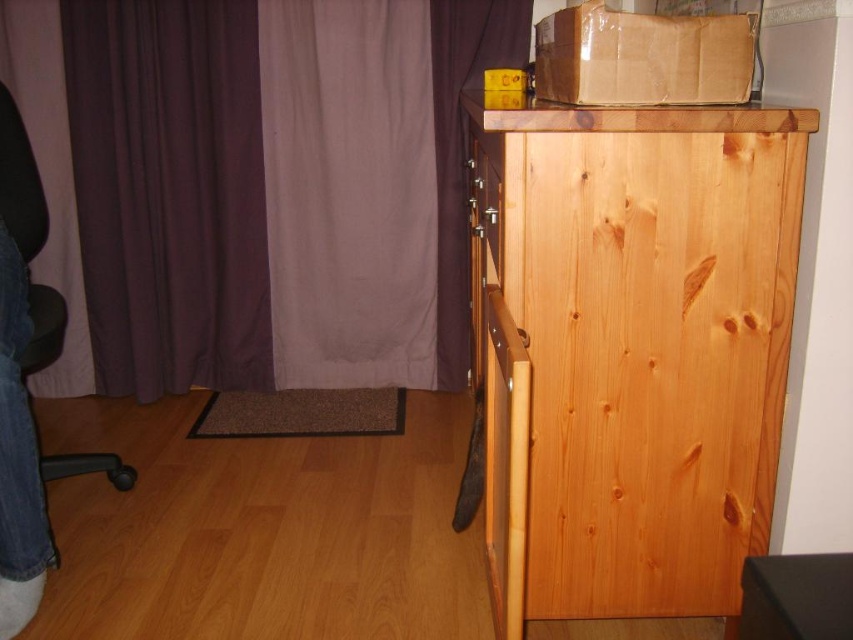
Does point (196, 228) come in front of point (7, 381)?

No, (196, 228) is further to viewer.

Based on the photo, is purple fabric curtain at upper left above denim jeans at lower left?

Yes.

What do you see at coordinates (170, 193) in the screenshot? I see `purple fabric curtain at upper left` at bounding box center [170, 193].

Where is `purple fabric curtain at upper left`? purple fabric curtain at upper left is located at coordinates (170, 193).

Is the position of natural wood dresser at upper right less distant than that of denim jeans at lower left?

That is True.

Is point (575, 209) closer to camera compared to point (41, 568)?

Yes, point (575, 209) is in front of point (41, 568).

Image resolution: width=853 pixels, height=640 pixels. I want to click on natural wood dresser at upper right, so click(631, 348).

You are a GUI agent. You are given a task and a screenshot of the screen. Output one action in this format:
    pyautogui.click(x=<x>, y=<y>)
    Task: Click on the natural wood dresser at upper right
    This screenshot has height=640, width=853.
    Given the screenshot: What is the action you would take?
    pyautogui.click(x=631, y=348)

Who is shorter, denim jeans at lower left or black mesh chair at left?

black mesh chair at left

Is point (0, 252) less distant than point (13, 172)?

Yes.

Find the location of a particular element. The width and height of the screenshot is (853, 640). denim jeans at lower left is located at coordinates (18, 458).